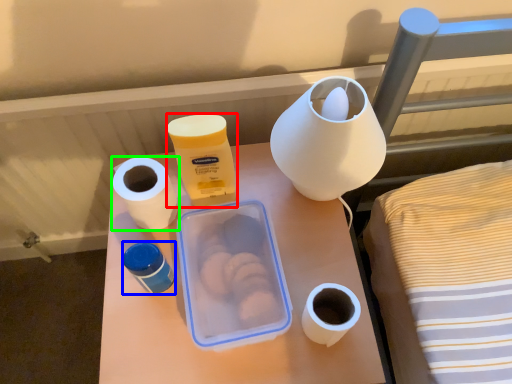
Question: Which object is positioned closest to product (highlighted by a red box)? Select from pottery (highlighted by a blue box) and paper towel (highlighted by a green box).

Choices:
 (A) pottery
 (B) paper towel

Answer: (B)